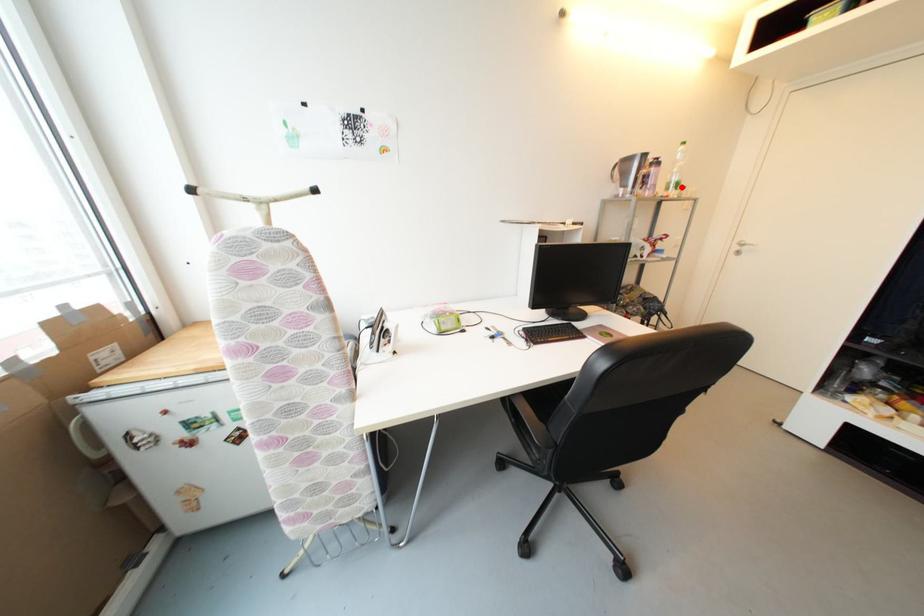
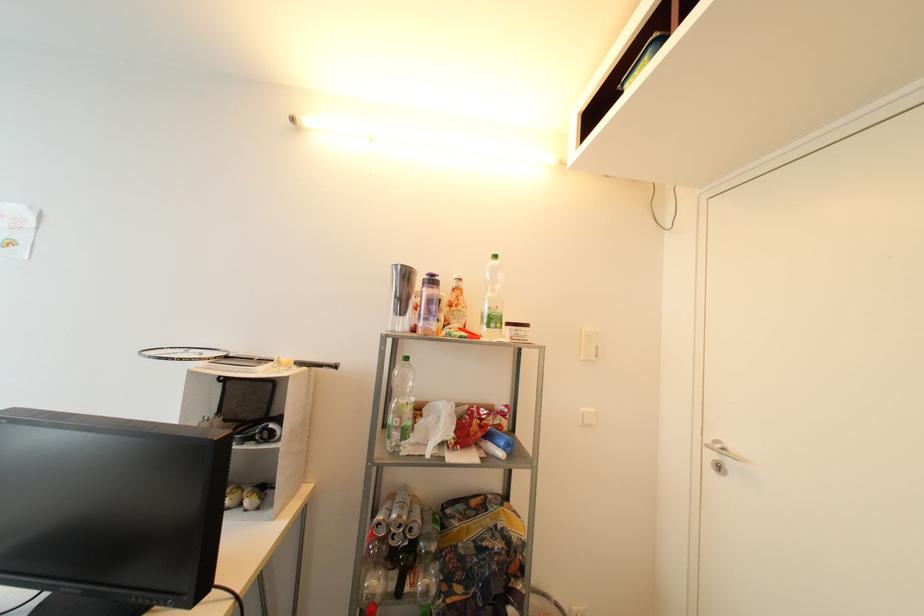
The point at the highlighted location is marked in the first image. Where is the corresponding point in the second image?

(499, 322)